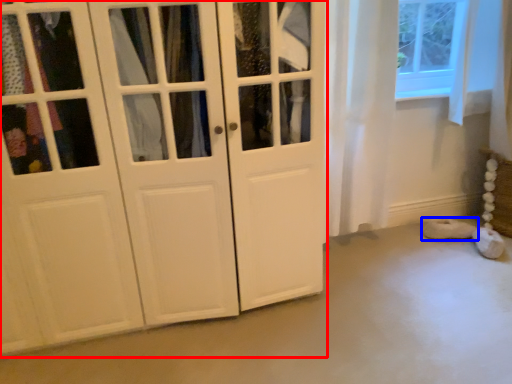
Question: Among these objects, which one is nearest to the camera, cupboard (highlighted by a red box) or footwear (highlighted by a blue box)?

Choices:
 (A) cupboard
 (B) footwear

Answer: (A)